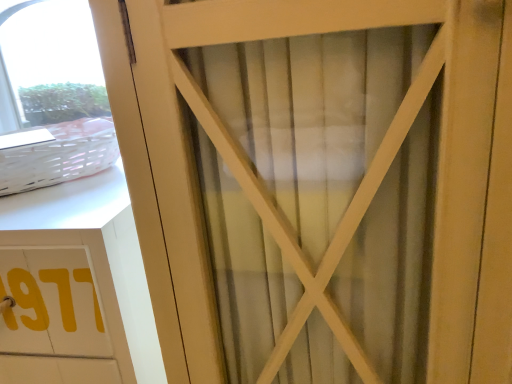
Question: Is white woven basket at upper left further to the viewer compared to white matte cabinet at left?

Choices:
 (A) no
 (B) yes

Answer: (B)

Question: From a real-world perspective, is white woven basket at upper left over white matte cabinet at left?

Choices:
 (A) yes
 (B) no

Answer: (A)

Question: From the image's perspective, is white woven basket at upper left above white matte cabinet at left?

Choices:
 (A) no
 (B) yes

Answer: (B)

Question: Can you confirm if white woven basket at upper left is taller than white matte cabinet at left?

Choices:
 (A) yes
 (B) no

Answer: (B)

Question: Considering the relative sizes of white woven basket at upper left and white matte cabinet at left in the image provided, is white woven basket at upper left wider than white matte cabinet at left?

Choices:
 (A) no
 (B) yes

Answer: (A)

Question: Does white woven basket at upper left have a lesser width compared to white matte cabinet at left?

Choices:
 (A) yes
 (B) no

Answer: (A)

Question: Can you confirm if white matte cabinet at left is bigger than white woven basket at upper left?

Choices:
 (A) yes
 (B) no

Answer: (A)

Question: Is white matte cabinet at left not inside white woven basket at upper left?

Choices:
 (A) no
 (B) yes

Answer: (B)

Question: Could white woven basket at upper left be considered to be inside white matte cabinet at left?

Choices:
 (A) yes
 (B) no

Answer: (B)

Question: Considering the relative sizes of white matte cabinet at left and white woven basket at upper left in the image provided, is white matte cabinet at left wider than white woven basket at upper left?

Choices:
 (A) no
 (B) yes

Answer: (B)

Question: Can you confirm if white matte cabinet at left is positioned to the right of white woven basket at upper left?

Choices:
 (A) no
 (B) yes

Answer: (A)

Question: From the image's perspective, is white matte cabinet at left on top of white woven basket at upper left?

Choices:
 (A) yes
 (B) no

Answer: (B)

Question: Relative to white woven basket at upper left, is white matte cabinet at left in front or behind?

Choices:
 (A) behind
 (B) front

Answer: (B)